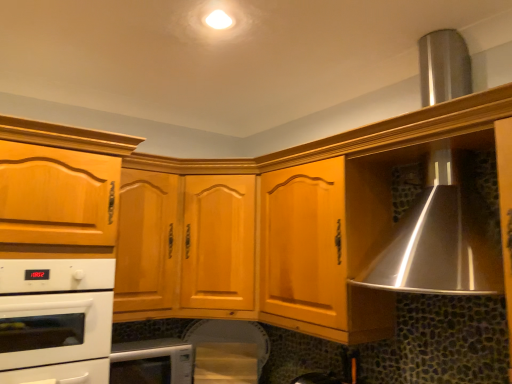
What is the approximate width of white glossy microwave at lower center, which is the first home appliance from bottom to top?

It is 36.38 centimeters.

This screenshot has height=384, width=512. Describe the element at coordinates (152, 362) in the screenshot. I see `white glossy microwave at lower center, the second home appliance positioned from the top` at that location.

Find the location of a particular element. The height and width of the screenshot is (384, 512). white glossy microwave at lower center, the second home appliance positioned from the top is located at coordinates (152, 362).

Is light brown wood cabinet at center, which appears as the second cabinetry when viewed from the left, at the back of white glossy oven at lower left, positioned as the 1th home appliance in top-to-bottom order?

No, light brown wood cabinet at center, which appears as the second cabinetry when viewed from the left, is not at the back of white glossy oven at lower left, positioned as the 1th home appliance in top-to-bottom order.

Is the depth of white glossy oven at lower left, positioned as the 1th home appliance in top-to-bottom order, less than that of light brown wood cabinet at center, which appears as the second cabinetry when viewed from the left?

That is True.

Looking at their sizes, would you say white glossy oven at lower left, positioned as the 1th home appliance in top-to-bottom order, is wider or thinner than light brown wood cabinet at center, which appears as the second cabinetry when viewed from the left?

Considering their sizes, white glossy oven at lower left, positioned as the 1th home appliance in top-to-bottom order, looks slimmer than light brown wood cabinet at center, which appears as the second cabinetry when viewed from the left.

Can you tell me how much white glossy oven at lower left, positioned as the 1th home appliance in top-to-bottom order, and light brown wood cabinet at center, which appears as the second cabinetry when viewed from the left, differ in facing direction?

The angular difference between white glossy oven at lower left, positioned as the 1th home appliance in top-to-bottom order, and light brown wood cabinet at center, which appears as the second cabinetry when viewed from the left, is 0.000721 degrees.

Does white glossy oven at lower left, positioned as the 1th home appliance in top-to-bottom order, have a greater height compared to white glossy microwave at lower center, the second home appliance positioned from the top?

Correct, white glossy oven at lower left, positioned as the 1th home appliance in top-to-bottom order, is much taller as white glossy microwave at lower center, the second home appliance positioned from the top.

Between white glossy oven at lower left, which is the second home appliance from bottom to top, and white glossy microwave at lower center, the second home appliance positioned from the top, which one appears on the right side from the viewer's perspective?

Positioned to the right is white glossy microwave at lower center, the second home appliance positioned from the top.

From the image's perspective, which is below, white glossy oven at lower left, which is the second home appliance from bottom to top, or white glossy microwave at lower center, the second home appliance positioned from the top?

white glossy microwave at lower center, the second home appliance positioned from the top.

Which of these two, white glossy microwave at lower center, which is the first home appliance from bottom to top, or matte wood cabinet at left, acting as the second cabinetry starting from the right, stands shorter?

white glossy microwave at lower center, which is the first home appliance from bottom to top, is shorter.

From a real-world perspective, is white glossy microwave at lower center, which is the first home appliance from bottom to top, positioned over matte wood cabinet at left, acting as the second cabinetry starting from the right, based on gravity?

No.

Looking at this image, is white glossy microwave at lower center, the second home appliance positioned from the top, further to the viewer compared to matte wood cabinet at left, the first cabinetry positioned from the left?

Yes, the depth of white glossy microwave at lower center, the second home appliance positioned from the top, is greater than that of matte wood cabinet at left, the first cabinetry positioned from the left.

What's the angular difference between white glossy oven at lower left, positioned as the 1th home appliance in top-to-bottom order, and matte wood cabinet at left, acting as the second cabinetry starting from the right,'s facing directions?

0.000768 degrees.

From a real-world perspective, is white glossy oven at lower left, which is the second home appliance from bottom to top, above or below matte wood cabinet at left, the first cabinetry positioned from the left?

white glossy oven at lower left, which is the second home appliance from bottom to top, is below matte wood cabinet at left, the first cabinetry positioned from the left.

Does point (18, 356) come behind point (15, 239)?

No, (18, 356) is in front of (15, 239).

Is matte wood cabinet at left, acting as the second cabinetry starting from the right, inside white glossy oven at lower left, positioned as the 1th home appliance in top-to-bottom order?

Yes, white glossy oven at lower left, positioned as the 1th home appliance in top-to-bottom order, is surrounding matte wood cabinet at left, acting as the second cabinetry starting from the right.

Which is behind, light brown wood cabinet at center, which appears as the second cabinetry when viewed from the left, or white glossy microwave at lower center, the second home appliance positioned from the top?

white glossy microwave at lower center, the second home appliance positioned from the top, is further away from the camera.

Is light brown wood cabinet at center, acting as the 1th cabinetry starting from the right, not within white glossy microwave at lower center, the second home appliance positioned from the top?

Yes.

Is light brown wood cabinet at center, acting as the 1th cabinetry starting from the right, bigger or smaller than white glossy microwave at lower center, the second home appliance positioned from the top?

light brown wood cabinet at center, acting as the 1th cabinetry starting from the right, is bigger than white glossy microwave at lower center, the second home appliance positioned from the top.

From a real-world perspective, is matte wood cabinet at left, acting as the second cabinetry starting from the right, above or below white glossy oven at lower left, positioned as the 1th home appliance in top-to-bottom order?

From a real-world perspective, matte wood cabinet at left, acting as the second cabinetry starting from the right, is physically above white glossy oven at lower left, positioned as the 1th home appliance in top-to-bottom order.

Is white glossy oven at lower left, which is the second home appliance from bottom to top, at the back of matte wood cabinet at left, acting as the second cabinetry starting from the right?

Absolutely, matte wood cabinet at left, acting as the second cabinetry starting from the right, is directed away from white glossy oven at lower left, which is the second home appliance from bottom to top.

Considering their positions, is matte wood cabinet at left, the first cabinetry positioned from the left, located in front of or behind white glossy oven at lower left, which is the second home appliance from bottom to top?

matte wood cabinet at left, the first cabinetry positioned from the left, is in front of white glossy oven at lower left, which is the second home appliance from bottom to top.

Considering the relative sizes of light brown wood cabinet at center, which appears as the second cabinetry when viewed from the left, and white glossy oven at lower left, positioned as the 1th home appliance in top-to-bottom order, in the image provided, is light brown wood cabinet at center, which appears as the second cabinetry when viewed from the left, thinner than white glossy oven at lower left, positioned as the 1th home appliance in top-to-bottom order,?

In fact, light brown wood cabinet at center, which appears as the second cabinetry when viewed from the left, might be wider than white glossy oven at lower left, positioned as the 1th home appliance in top-to-bottom order.

Could you tell me if light brown wood cabinet at center, acting as the 1th cabinetry starting from the right, is facing white glossy oven at lower left, positioned as the 1th home appliance in top-to-bottom order?

No, light brown wood cabinet at center, acting as the 1th cabinetry starting from the right, is not oriented towards white glossy oven at lower left, positioned as the 1th home appliance in top-to-bottom order.

From the picture: Is light brown wood cabinet at center, which appears as the second cabinetry when viewed from the left, bigger than white glossy oven at lower left, which is the second home appliance from bottom to top?

Yes, light brown wood cabinet at center, which appears as the second cabinetry when viewed from the left, is bigger than white glossy oven at lower left, which is the second home appliance from bottom to top.

Where is `home appliance that is the 1st one when counting downward from the light brown wood cabinet at center, which appears as the second cabinetry when viewed from the left (from the image's perspective)`? This screenshot has width=512, height=384. home appliance that is the 1st one when counting downward from the light brown wood cabinet at center, which appears as the second cabinetry when viewed from the left (from the image's perspective) is located at coordinates (55, 319).

Find the location of a particular element. This screenshot has width=512, height=384. home appliance that is in front of the white glossy microwave at lower center, which is the first home appliance from bottom to top is located at coordinates (55, 319).

Considering their positions, is white glossy oven at lower left, positioned as the 1th home appliance in top-to-bottom order, positioned closer to matte wood cabinet at left, acting as the second cabinetry starting from the right, than light brown wood cabinet at center, which appears as the second cabinetry when viewed from the left?

Based on the image, white glossy oven at lower left, positioned as the 1th home appliance in top-to-bottom order, appears to be nearer to matte wood cabinet at left, acting as the second cabinetry starting from the right.

Based on their spatial positions, is light brown wood cabinet at center, which appears as the second cabinetry when viewed from the left, or white glossy microwave at lower center, which is the first home appliance from bottom to top, closer to white glossy oven at lower left, which is the second home appliance from bottom to top?

white glossy microwave at lower center, which is the first home appliance from bottom to top, is positioned closer to the anchor white glossy oven at lower left, which is the second home appliance from bottom to top.

Which object lies further to the anchor point matte wood cabinet at left, the first cabinetry positioned from the left, white glossy microwave at lower center, the second home appliance positioned from the top, or white glossy oven at lower left, which is the second home appliance from bottom to top?

white glossy microwave at lower center, the second home appliance positioned from the top, lies further to matte wood cabinet at left, the first cabinetry positioned from the left, than the other object.

Which object lies nearer to the anchor point white glossy microwave at lower center, which is the first home appliance from bottom to top, white glossy oven at lower left, positioned as the 1th home appliance in top-to-bottom order, or matte wood cabinet at left, the first cabinetry positioned from the left?

Among the two, white glossy oven at lower left, positioned as the 1th home appliance in top-to-bottom order, is located nearer to white glossy microwave at lower center, which is the first home appliance from bottom to top.

Estimate the real-world distances between objects in this image. Which object is closer to white glossy oven at lower left, which is the second home appliance from bottom to top, matte wood cabinet at left, acting as the second cabinetry starting from the right, or light brown wood cabinet at center, acting as the 1th cabinetry starting from the right?

Among the two, matte wood cabinet at left, acting as the second cabinetry starting from the right, is located nearer to white glossy oven at lower left, which is the second home appliance from bottom to top.

Considering their positions, is light brown wood cabinet at center, acting as the 1th cabinetry starting from the right, positioned closer to white glossy oven at lower left, which is the second home appliance from bottom to top, than matte wood cabinet at left, acting as the second cabinetry starting from the right?

Among the two, matte wood cabinet at left, acting as the second cabinetry starting from the right, is located nearer to white glossy oven at lower left, which is the second home appliance from bottom to top.

Which object lies nearer to the anchor point light brown wood cabinet at center, which appears as the second cabinetry when viewed from the left, matte wood cabinet at left, acting as the second cabinetry starting from the right, or white glossy microwave at lower center, which is the first home appliance from bottom to top?

white glossy microwave at lower center, which is the first home appliance from bottom to top, is closer to light brown wood cabinet at center, which appears as the second cabinetry when viewed from the left.

Looking at the image, which one is located further to white glossy oven at lower left, positioned as the 1th home appliance in top-to-bottom order, white glossy microwave at lower center, the second home appliance positioned from the top, or matte wood cabinet at left, the first cabinetry positioned from the left?

Among the two, white glossy microwave at lower center, the second home appliance positioned from the top, is located further to white glossy oven at lower left, positioned as the 1th home appliance in top-to-bottom order.

The image size is (512, 384). What are the coordinates of `home appliance that lies between light brown wood cabinet at center, which appears as the second cabinetry when viewed from the left, and white glossy microwave at lower center, the second home appliance positioned from the top, from top to bottom` in the screenshot? It's located at (55, 319).

Image resolution: width=512 pixels, height=384 pixels. I want to click on home appliance located between matte wood cabinet at left, the first cabinetry positioned from the left, and white glossy microwave at lower center, which is the first home appliance from bottom to top, in the depth direction, so click(x=55, y=319).

Image resolution: width=512 pixels, height=384 pixels. I want to click on cabinetry between light brown wood cabinet at center, acting as the 1th cabinetry starting from the right, and white glossy microwave at lower center, which is the first home appliance from bottom to top, in the up-down direction, so click(59, 189).